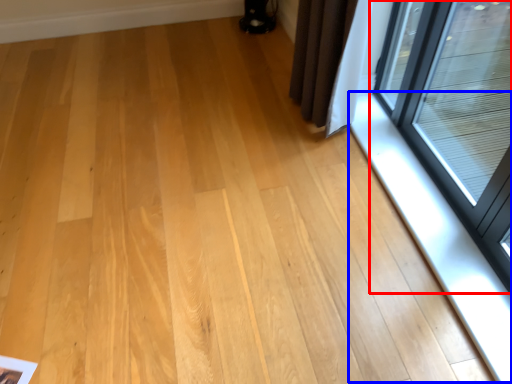
Question: Which object appears closest to the camera in this image, window (highlighted by a red box) or window sill (highlighted by a blue box)?

Choices:
 (A) window
 (B) window sill

Answer: (A)